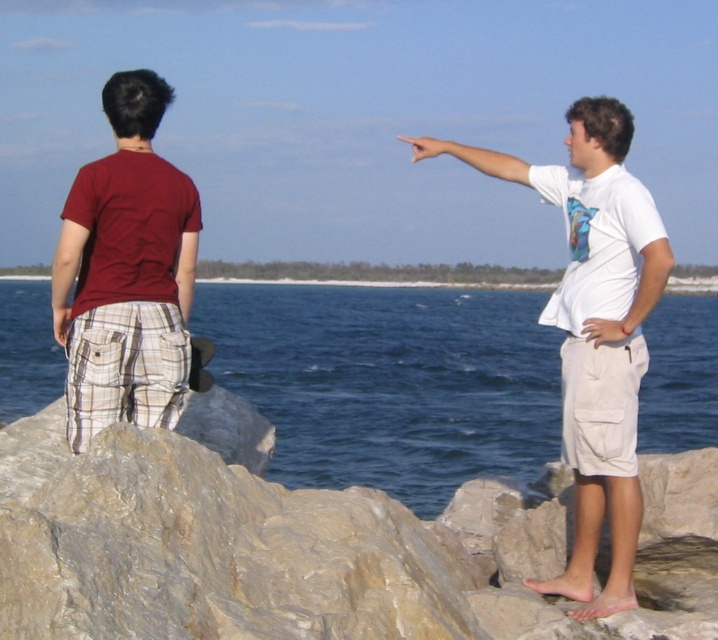
In the scene shown: Does matte red t-shirt at left have a smaller size compared to blue shiny tie at right?

No.

Consider the image. Does matte red t-shirt at left have a lesser height compared to blue shiny tie at right?

No.

You are a GUI agent. You are given a task and a screenshot of the screen. Output one action in this format:
    pyautogui.click(x=<x>, y=<y>)
    Task: Click on the matte red t-shirt at left
    
    Given the screenshot: What is the action you would take?
    pyautogui.click(x=126, y=273)

Where is `matte red t-shirt at left`? This screenshot has height=640, width=718. matte red t-shirt at left is located at coordinates (126, 273).

In the scene shown: Does white cotton shirt at right have a greater height compared to matte red t-shirt at left?

Correct, white cotton shirt at right is much taller as matte red t-shirt at left.

Describe the element at coordinates (595, 333) in the screenshot. This screenshot has height=640, width=718. I see `white cotton shirt at right` at that location.

Is point (615, 356) farther from camera compared to point (69, 320)?

Yes, it is.

Find the location of `white cotton shirt at right`. white cotton shirt at right is located at coordinates (595, 333).

Between point (648, 333) and point (121, 176), which one is positioned in front?

Point (121, 176) is more forward.

Where is `blue water at center`? The image size is (718, 640). blue water at center is located at coordinates (391, 381).

Is point (17, 410) more distant than point (111, 243)?

Yes, it is.

Identify the location of blue water at center. Image resolution: width=718 pixels, height=640 pixels. (391, 381).